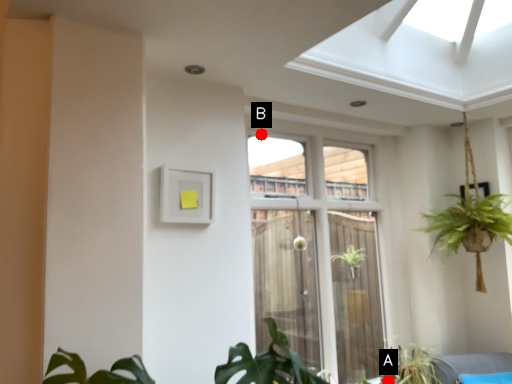
Question: Two points are circled on the image, labeled by A and B beside each circle. Which point is farther to the camera?

Choices:
 (A) A is further
 (B) B is further

Answer: (A)